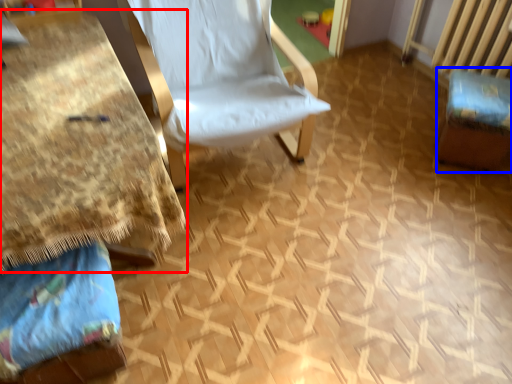
Question: Among these objects, which one is nearest to the camera, table (highlighted by a red box) or swivel chair (highlighted by a blue box)?

Choices:
 (A) table
 (B) swivel chair

Answer: (A)